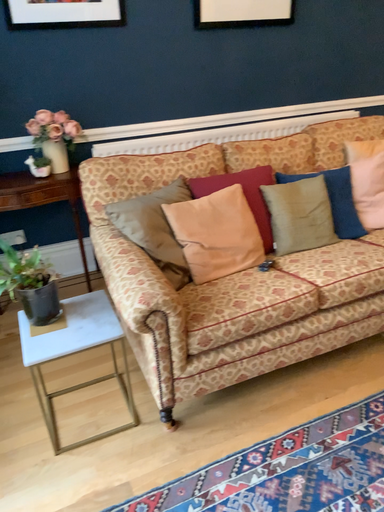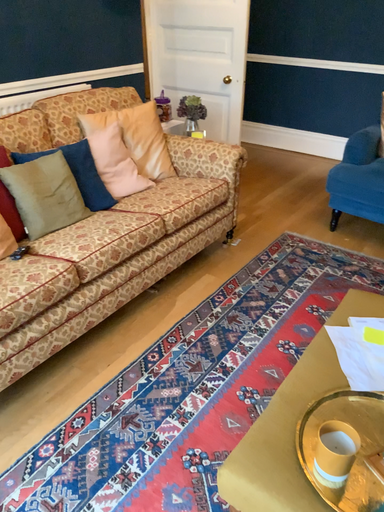
Question: Which way did the camera rotate in the video?

Choices:
 (A) rotated left
 (B) rotated right

Answer: (B)